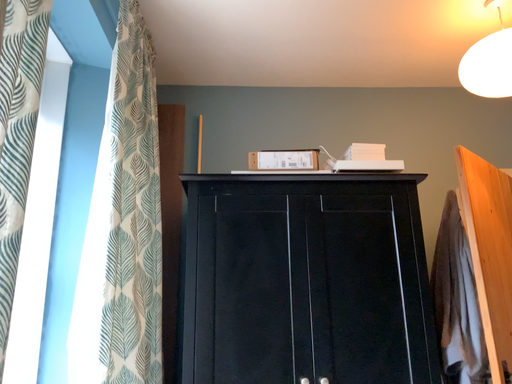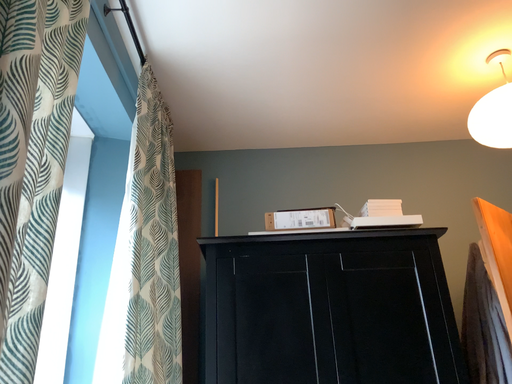
Question: Which way did the camera rotate in the video?

Choices:
 (A) rotated upward
 (B) rotated downward

Answer: (A)